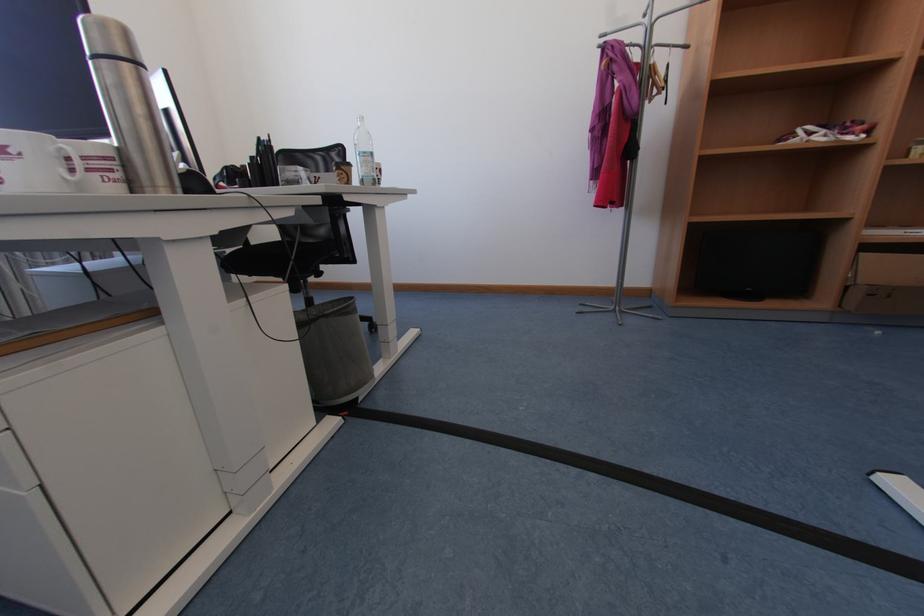
Find the location of a particular element. Image resolution: width=924 pixels, height=616 pixels. glass water bottle is located at coordinates (363, 155).